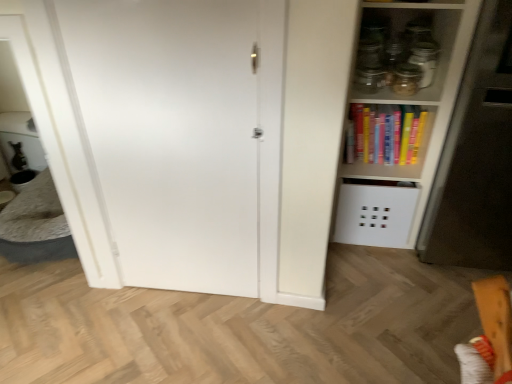
I want to click on spots to the right of white matte door at center, so click(x=270, y=321).